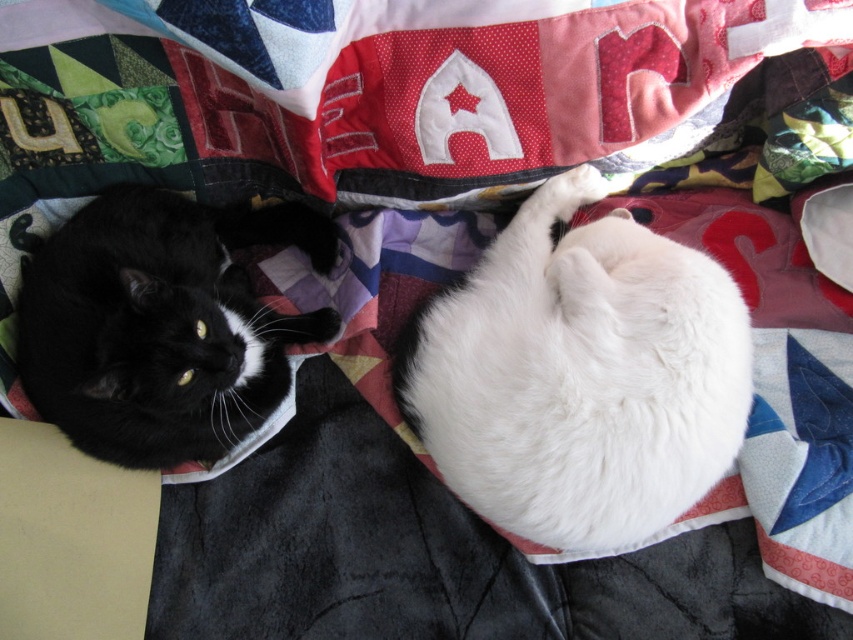
You are a photographer trying to capture a photo of both the white fluffy cat at center and the black fur cat at left. Based on their positions, which cat should you focus on first to ensure both are in the frame?

The white fluffy cat at center is located below the black fur cat at left, so you should focus on the black fur cat at left first to ensure both are in the frame.

Looking at this image, you are a cat owner who wants to pet your cat. You are standing 1.13 meters away from the white fluffy cat at center. Can you reach the cat without moving closer?

The white fluffy cat at center and viewer are 1.13 meters apart, so unless you have an unusually long arm, you cannot reach the cat without moving closer.